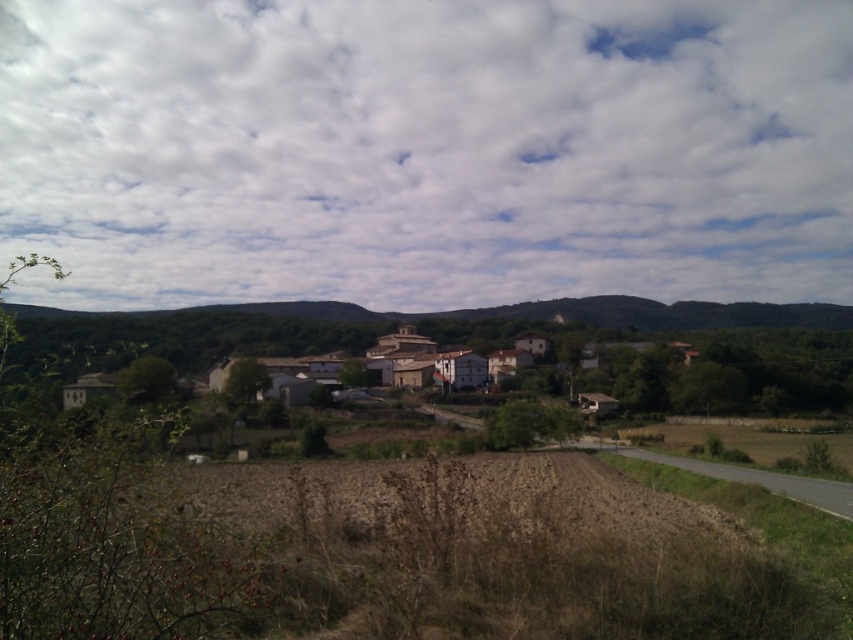
You are a drone operator flying over the rural landscape. Your mission is to capture aerial footage of both the white fluffy clouds at upper center and the white stucco village at center. Which object should you prioritize filming first if you want to maintain your current altitude?

The white fluffy clouds at upper center should be filmed first because they are above the white stucco village at center, so if you wait to film the village, you might need to descend to adjust your altitude.

You are standing in the plowed field in the foreground of the image. You want to take a photo of the white stucco village at center with the white fluffy clouds at upper center in the background. Can you position yourself so that both the village and the clouds are in the same frame without moving the camera?

The white fluffy clouds at upper center are 935.55 feet away from the white stucco village at center. Since the distance between them is significant, positioning yourself to capture both in the same frame without moving the camera may be challenging, but it depends on the camera lens and zoom capabilities. However, based on the given information, the distance suggests they might not naturally fit in one frame unless using a wide angle lens.